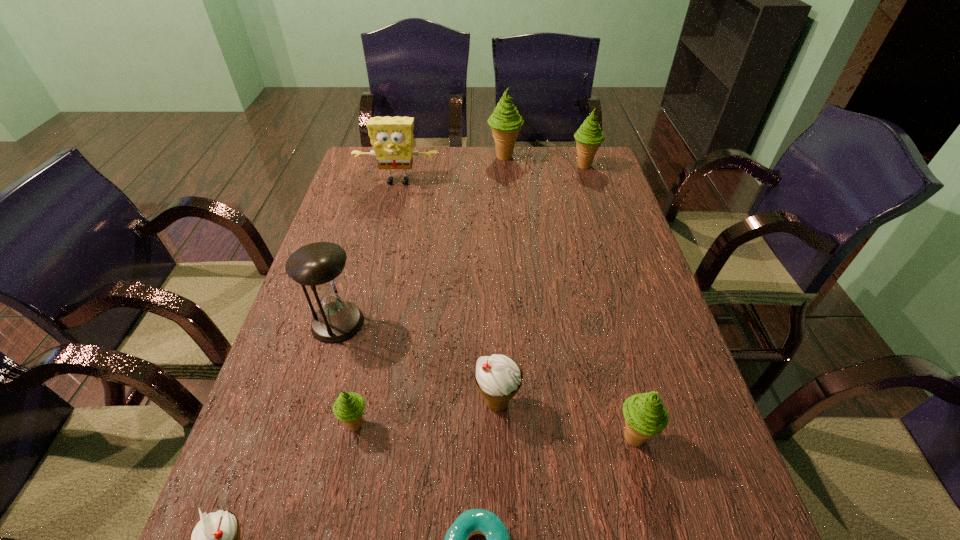
The image size is (960, 540). Identify the location of free space between the leftmost green icecream and the right white icecream. (427, 414).

At what (x,y) coordinates should I click in order to perform the action: click on free space between the third biggest green icecream and the tallest icecream. Please return your answer as a coordinate pair (x, y). Image resolution: width=960 pixels, height=540 pixels. Looking at the image, I should click on (569, 297).

At what (x,y) coordinates should I click in order to perform the action: click on unoccupied area between the third biggest green icecream and the tallest icecream. Please return your answer as a coordinate pair (x, y). This screenshot has height=540, width=960. Looking at the image, I should click on (569, 297).

Select which object is the third closest to the hourglass. Please provide its 2D coordinates. Your answer should be formatted as a tuple, i.e. [(x, y)], where the tuple contains the x and y coordinates of a point satisfying the conditions above.

[(216, 539)]

Select which object is the fourth closest to the tallest icecream. Please provide its 2D coordinates. Your answer should be formatted as a tuple, i.e. [(x, y)], where the tuple contains the x and y coordinates of a point satisfying the conditions above.

[(498, 378)]

Locate which icecream ranks fifth in proximity to the third smallest green icecream. Please provide its 2D coordinates. Your answer should be formatted as a tuple, i.e. [(x, y)], where the tuple contains the x and y coordinates of a point satisfying the conditions above.

[(216, 539)]

Where is `icecream identified as the fourth closest to the second smallest green icecream`? The image size is (960, 540). icecream identified as the fourth closest to the second smallest green icecream is located at coordinates (589, 136).

I want to click on green icecream that is the second closest to the bigger white icecream, so click(348, 408).

At what (x,y) coordinates should I click in order to perform the action: click on green icecream that is the third closest to the leftmost icecream. Please return your answer as a coordinate pair (x, y). This screenshot has width=960, height=540. Looking at the image, I should click on (505, 122).

Identify the location of vacant space that satisfies the following two spatial constraints: 1. on the face of the yellow sponge; 2. on the right side of the third biggest green icecream. (338, 437).